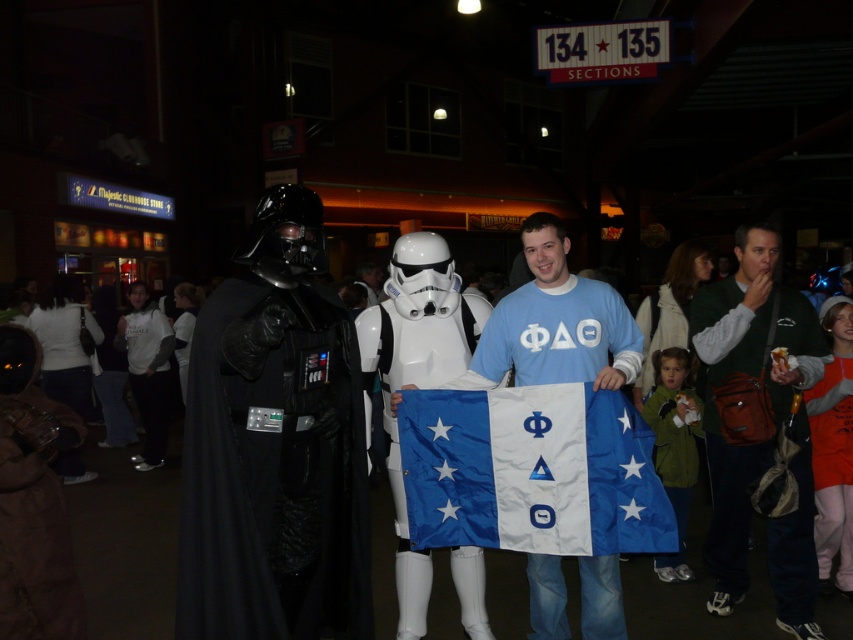
You are a photographer at the event and need to capture a photo that includes both the orange fleece sweatshirt at lower right and the white matte hoodie at center. Which clothing item will appear smaller in the photo?

The orange fleece sweatshirt at lower right will appear smaller in the photo because it is shorter than the white matte hoodie at center.